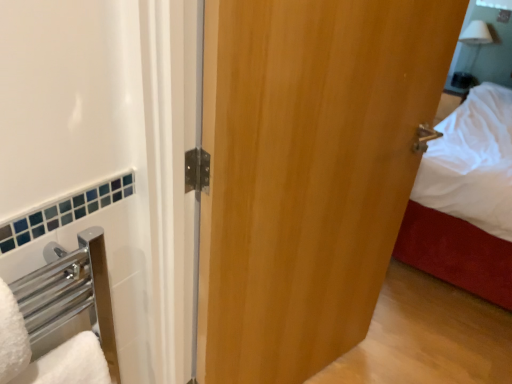
Question: Which is correct: wooden door at center is inside white fluffy bath towel at lower left, or outside of it?

Choices:
 (A) inside
 (B) outside

Answer: (B)

Question: Is wooden door at center to the left or to the right of white fluffy bath towel at lower left in the image?

Choices:
 (A) left
 (B) right

Answer: (B)

Question: Based on their relative distances, which object is nearer to the white fluffy bath towel at lower left?

Choices:
 (A) wooden door at center
 (B) white glossy mirror at upper right

Answer: (A)

Question: Based on their relative distances, which object is nearer to the white fluffy bath towel at lower left?

Choices:
 (A) white glossy mirror at upper right
 (B) wooden door at center

Answer: (B)